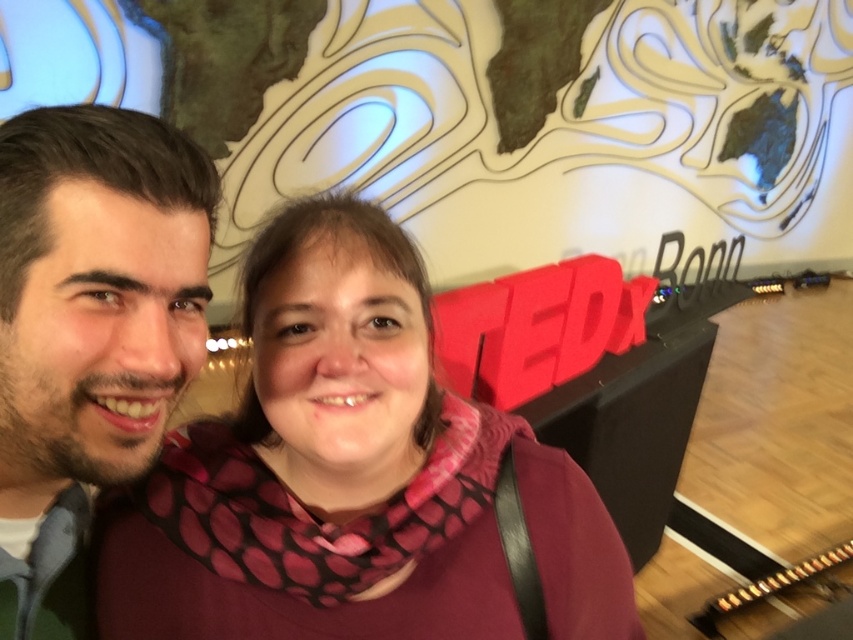
Is pink dotted scarf at center to the left of dark brown hair at left from the viewer's perspective?

No, pink dotted scarf at center is not to the left of dark brown hair at left.

At what (x,y) coordinates should I click in order to perform the action: click on pink dotted scarf at center. Please return your answer as a coordinate pair (x, y). Looking at the image, I should click on (349, 476).

I want to click on pink dotted scarf at center, so click(349, 476).